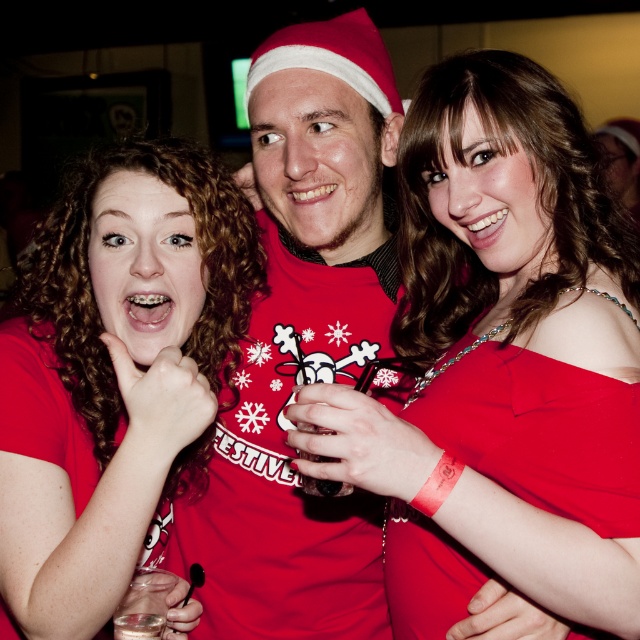
You are organizing a charity event and need to decide which of the two red outfits to display prominently. The matte red sweater at center and the red satin dress at center are both candidates. Based on their sizes, which one would you choose to place in the main exhibition area to make a more impactful visual statement?

The matte red sweater at center is larger in size than the red satin dress at center, so it would make a more impactful visual statement and should be placed in the main exhibition area.

Consider the image. You are a photographer at the event and want to capture a group photo of the matte red dress at center and the matte red shirt at center. The camera you have can only focus on objects within 15 inches of each other. Will both subjects be in focus?

The distance between the matte red dress at center and the matte red shirt at center is 16.72 inches, which is beyond the camera focus range of 15 inches. Therefore, both subjects cannot be in focus simultaneously.